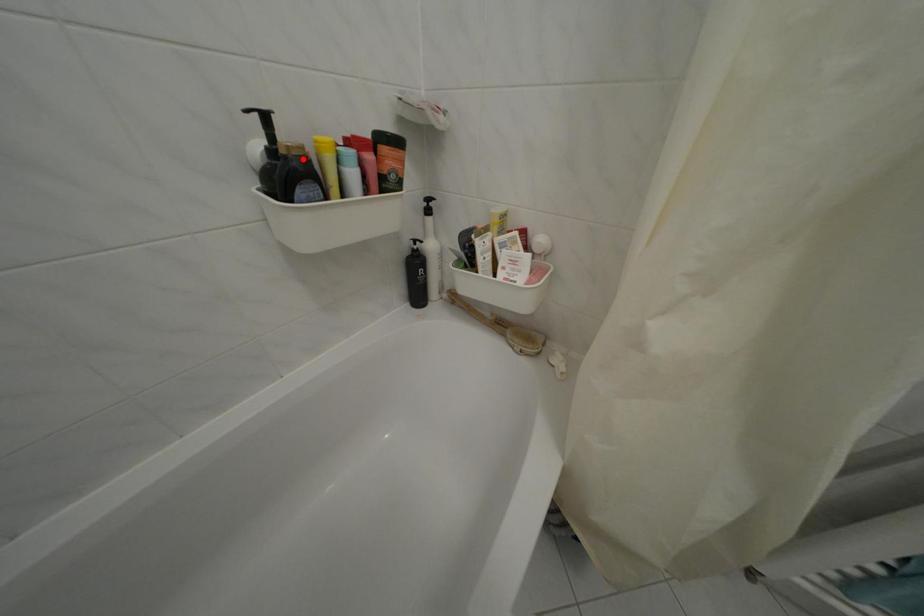
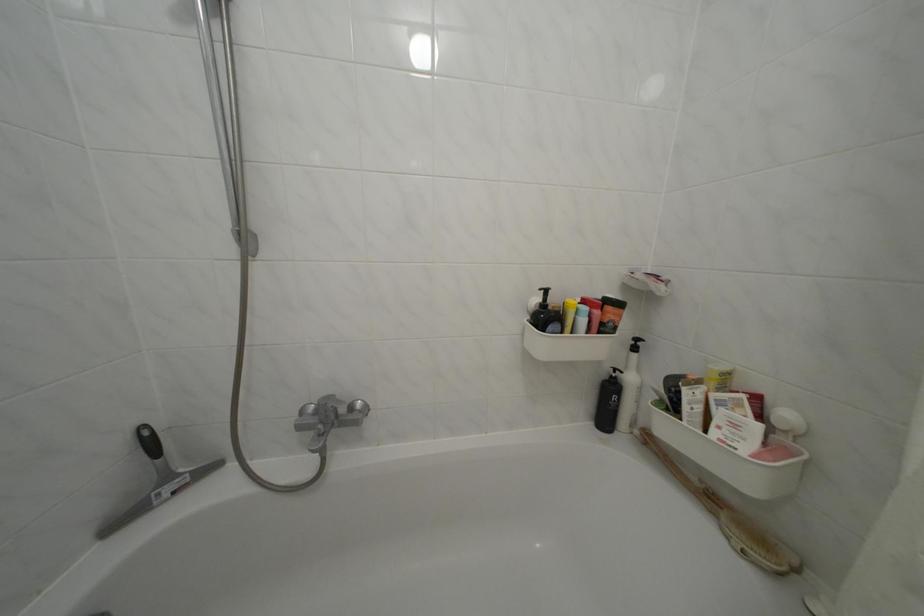
In the second image, find the point that corresponds to the highlighted location in the first image.

(565, 315)